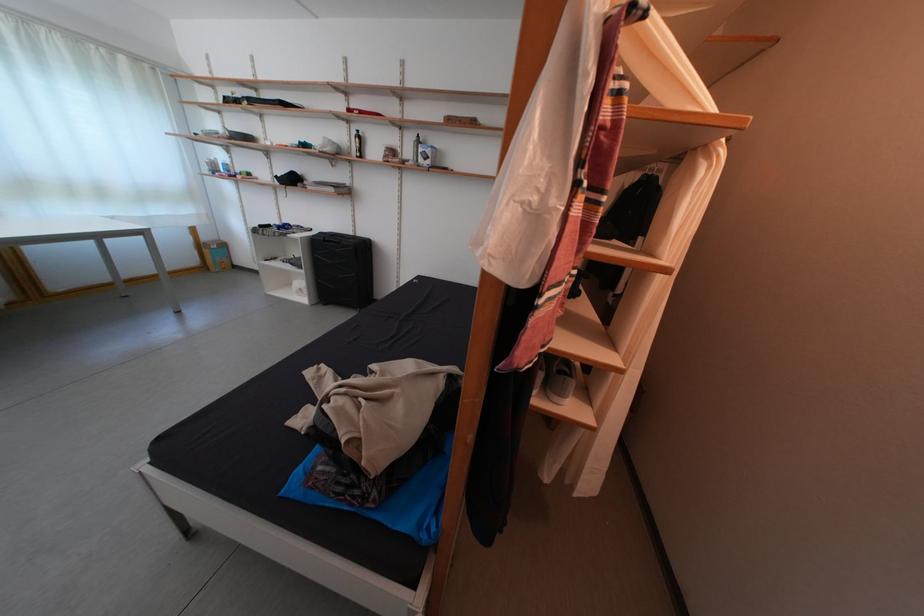
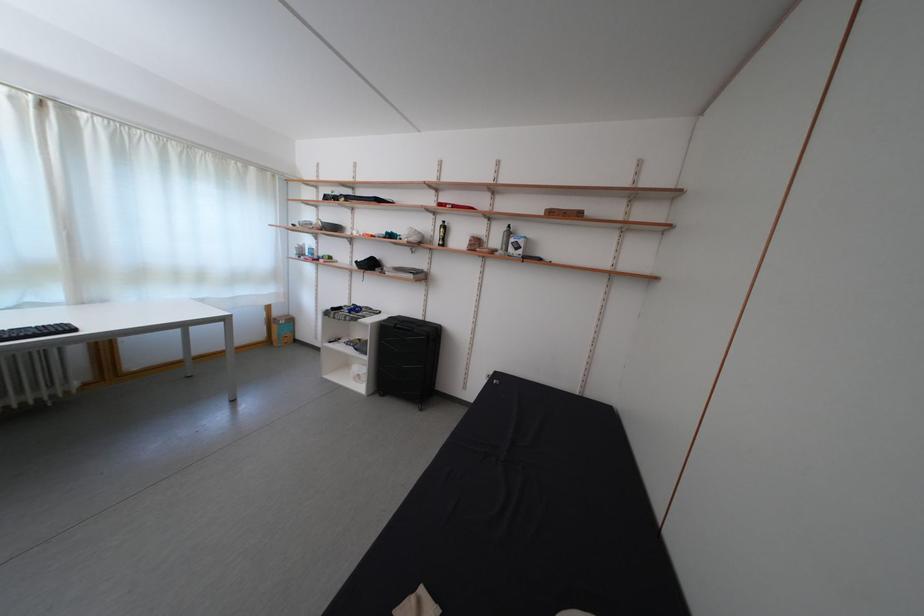
Locate, in the second image, the point that corresponds to [213,244] in the first image.

(285, 320)